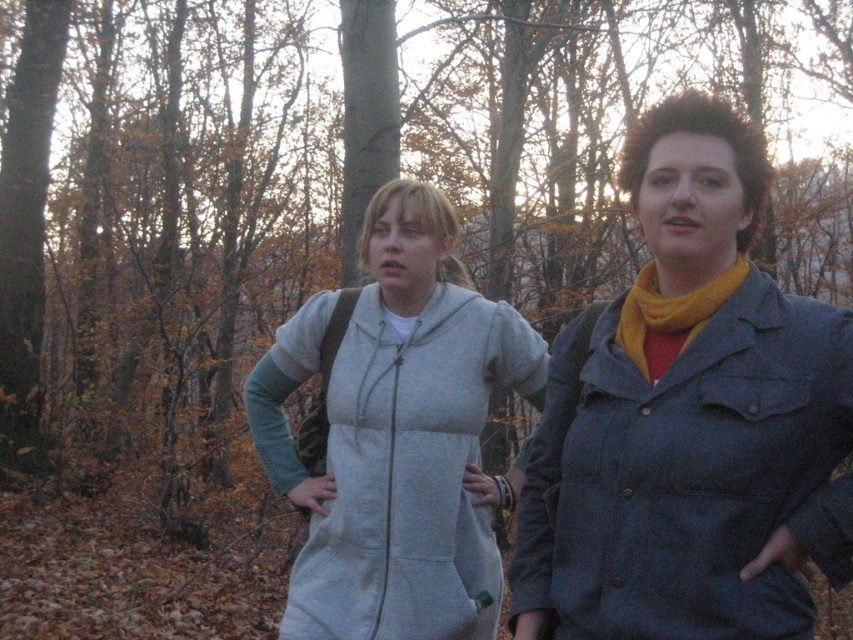
Can you confirm if denim jacket at right is thinner than yellow fuzzy scarf at right?

No, denim jacket at right is not thinner than yellow fuzzy scarf at right.

Between denim jacket at right and yellow fuzzy scarf at right, which one is positioned lower?

Positioned lower is denim jacket at right.

Describe the element at coordinates (689, 474) in the screenshot. I see `denim jacket at right` at that location.

Locate an element on the screen. denim jacket at right is located at coordinates (689, 474).

Is gray fleece hoodie at center taller than yellow fuzzy scarf at right?

Yes.

Who is positioned more to the left, gray fleece hoodie at center or yellow fuzzy scarf at right?

Positioned to the left is gray fleece hoodie at center.

Who is more distant from viewer, (399, 595) or (659, 308)?

Point (399, 595)

Where is `gray fleece hoodie at center`? The image size is (853, 640). gray fleece hoodie at center is located at coordinates (395, 435).

Who is positioned more to the right, denim jacket at right or gray fleece hoodie at center?

denim jacket at right

Does point (706, 602) lie in front of point (434, 196)?

Yes, it is.

Between point (738, 564) and point (428, 358), which one is positioned behind?

The point (428, 358) is more distant.

Identify the location of denim jacket at right. (689, 474).